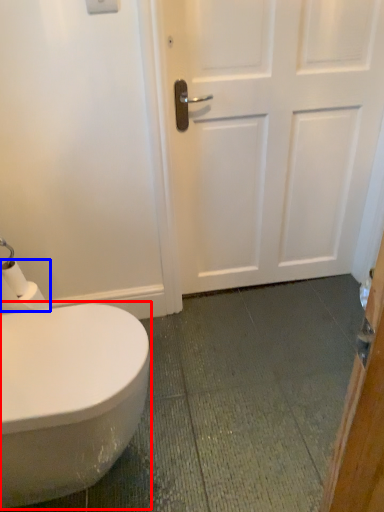
Question: Which of the following is the closest to the observer, bidet (highlighted by a red box) or toilet paper (highlighted by a blue box)?

Choices:
 (A) bidet
 (B) toilet paper

Answer: (A)